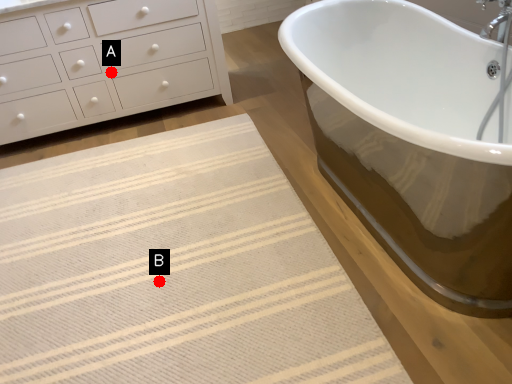
Question: Two points are circled on the image, labeled by A and B beside each circle. Which point is further to the camera?

Choices:
 (A) A is further
 (B) B is further

Answer: (A)